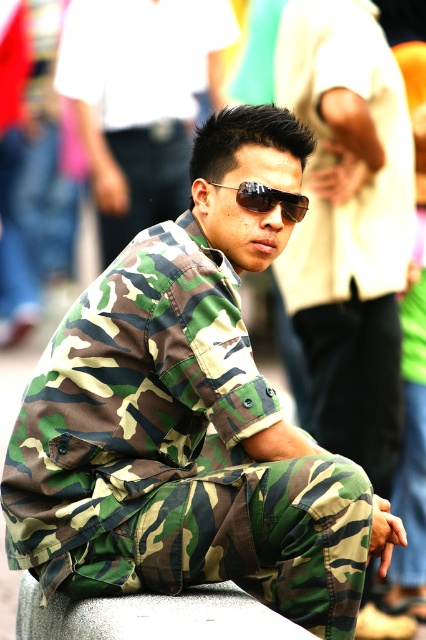
You are standing in an urban setting and see the gray textured concrete at center and sunglasses at center. Which object is closer to the ground?

The gray textured concrete at center is closer to the ground because it is located below the sunglasses at center.

You are a photographer trying to capture a portrait of the person wearing the camo fabric uniform at center and sunglasses at center. Since the background is blurred, you want to ensure the subject is in focus. Which object should you focus on to ensure both are sharp?

The camo fabric uniform at center is taller than sunglasses at center, so focusing on the camo fabric uniform at center will ensure both objects are in focus as it is the larger and primary subject.

You are a photographer trying to capture the person in the camo fabric uniform at center without the sunglasses at center obstructing the face. Can you adjust your camera angle to achieve this?

The sunglasses at center is behind the camo fabric uniform at center, so adjusting the camera angle might not help since the sunglasses are already obscured by the uniform. You might need to ask the subject to remove them.